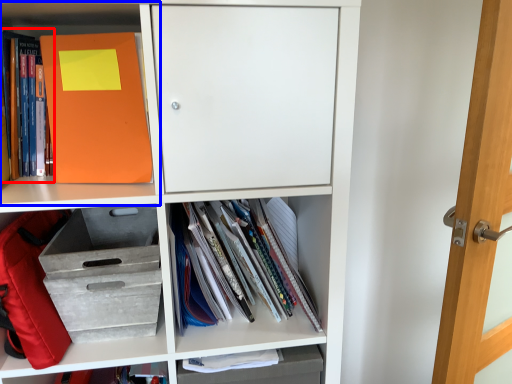
Question: Which of the following is the closest to the observer, book (highlighted by a red box) or shelf (highlighted by a blue box)?

Choices:
 (A) book
 (B) shelf

Answer: (B)